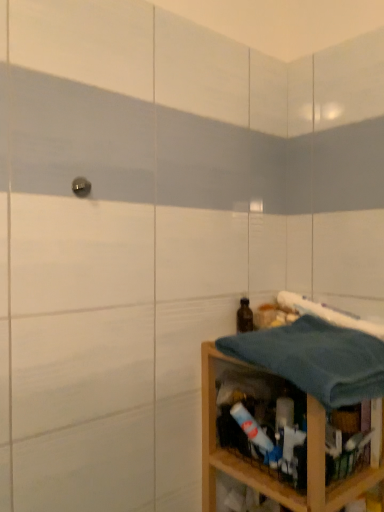
Question: In terms of width, does blue waffle weave bath towel at right, which is the second bath towel from bottom to top, look wider or thinner when compared to blue cotton towel at lower right, acting as the 2th bath towel starting from the top?

Choices:
 (A) thin
 (B) wide

Answer: (A)

Question: From the image's perspective, is blue waffle weave bath towel at right, which is the second bath towel from bottom to top, located above or below blue cotton towel at lower right, acting as the 2th bath towel starting from the top?

Choices:
 (A) below
 (B) above

Answer: (B)

Question: Considering the real-world distances, which object is closest to the wooden shelf at lower right?

Choices:
 (A) blue waffle weave bath towel at right, which is the second bath towel from bottom to top
 (B) brown glass bottle at lower right
 (C) blue cotton towel at lower right, acting as the 2th bath towel starting from the top

Answer: (C)

Question: Considering the real-world distances, which object is farthest from the brown glass bottle at lower right?

Choices:
 (A) wooden shelf at lower right
 (B) blue waffle weave bath towel at right, which is the second bath towel from bottom to top
 (C) blue cotton towel at lower right, the first bath towel from the bottom

Answer: (A)